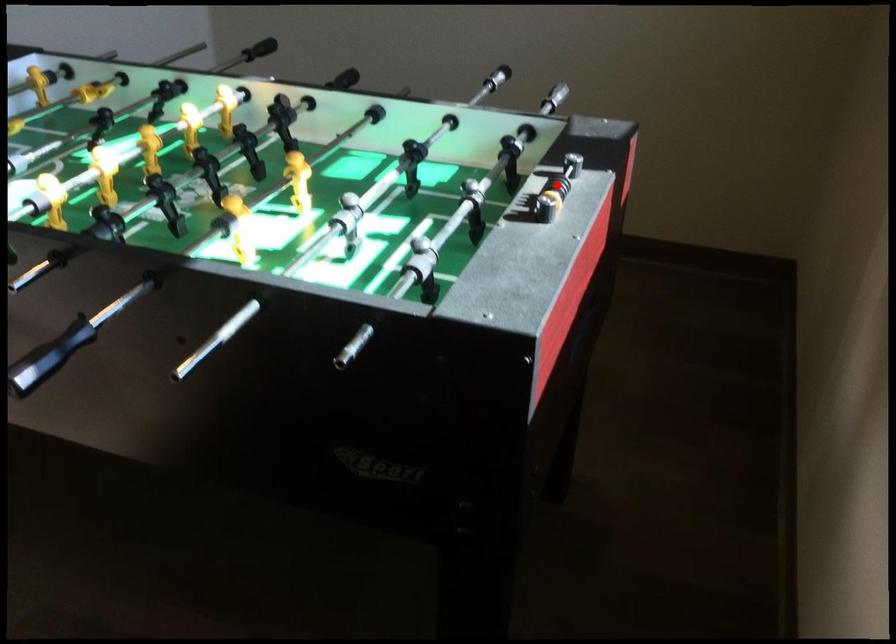
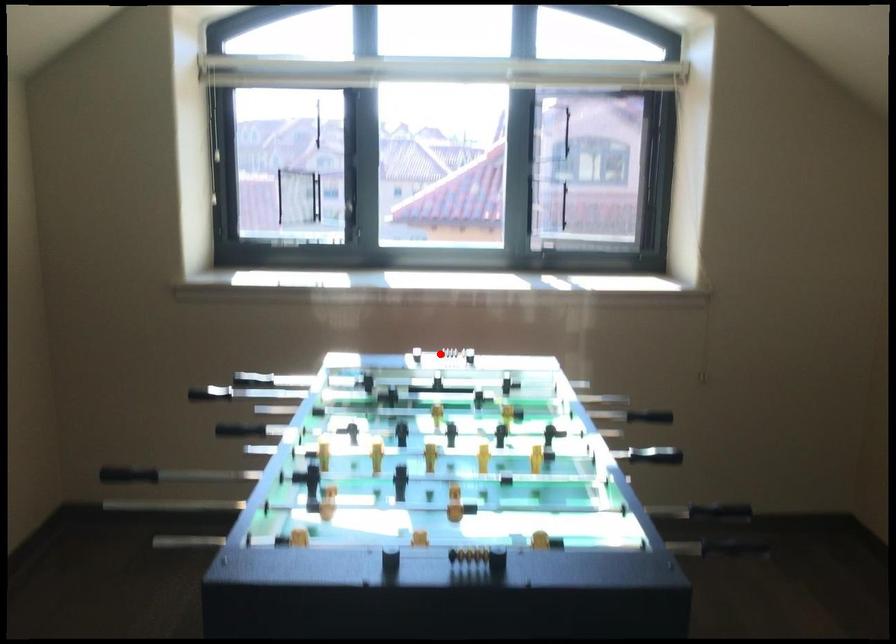
I am providing you with two images of the same scene from different viewpoints. A red point is marked on the first image and another point is marked on the second image. Are the points marked in image1 and image2 representing the same 3D position?

Yes